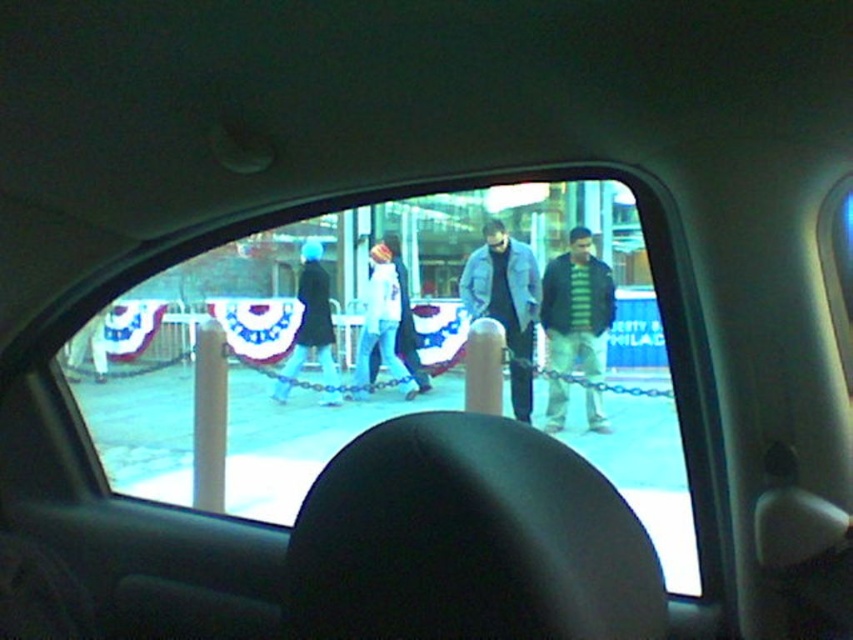
Is transparent glass window at center above light blue denim jacket at center?

Incorrect, transparent glass window at center is not positioned above light blue denim jacket at center.

Can you confirm if transparent glass window at center is positioned below light blue denim jacket at center?

Indeed, transparent glass window at center is positioned under light blue denim jacket at center.

Is point (398, 260) farther from viewer compared to point (392, 362)?

Yes, point (398, 260) is behind point (392, 362).

At what (x,y) coordinates should I click in order to perform the action: click on transparent glass window at center. Please return your answer as a coordinate pair (x, y). This screenshot has height=640, width=853. Looking at the image, I should click on (412, 348).

Is transparent glass window at center below black coat at center?

Yes.

Is point (349, 321) less distant than point (332, 378)?

No, it is not.

Identify the location of transparent glass window at center. (412, 348).

Can you confirm if transparent glass window at center is taller than striped knit sweater at center?

In fact, transparent glass window at center may be shorter than striped knit sweater at center.

Who is more forward, (328, 230) or (550, 310)?

Positioned in front is point (550, 310).

Image resolution: width=853 pixels, height=640 pixels. I want to click on transparent glass window at center, so click(x=412, y=348).